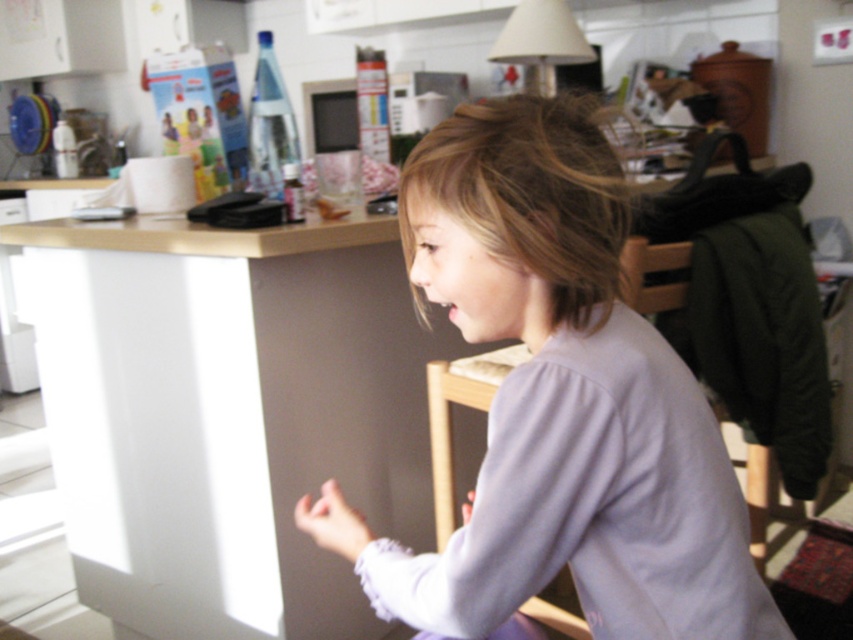
You are a parent trying to locate your child in the kitchen. You see the light purple fabric at center and the blonde smooth hair at center. Which object is closer to you?

The light purple fabric at center is closer to you because it is in front of the blonde smooth hair at center.